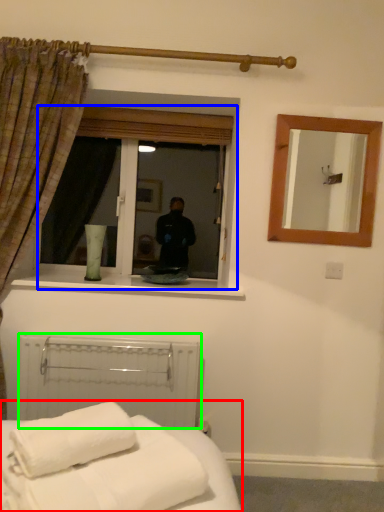
Question: Estimate the real-world distances between objects in this image. Which object is farther from bed (highlighted by a red box), window (highlighted by a blue box) or balustrade (highlighted by a green box)?

Choices:
 (A) window
 (B) balustrade

Answer: (A)